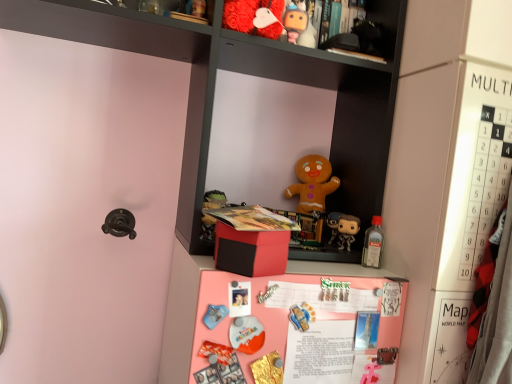
Where is `space that is in front of matte black figurine at center-right, the 4th toy from the bottom`? The image size is (512, 384). space that is in front of matte black figurine at center-right, the 4th toy from the bottom is located at coordinates (362, 277).